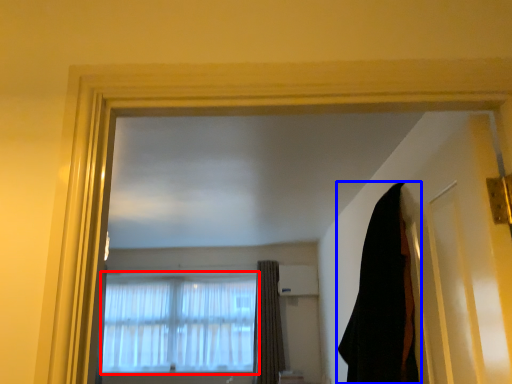
Question: Which of the following is the closest to the observer, window (highlighted by a red box) or curtain (highlighted by a blue box)?

Choices:
 (A) window
 (B) curtain

Answer: (B)